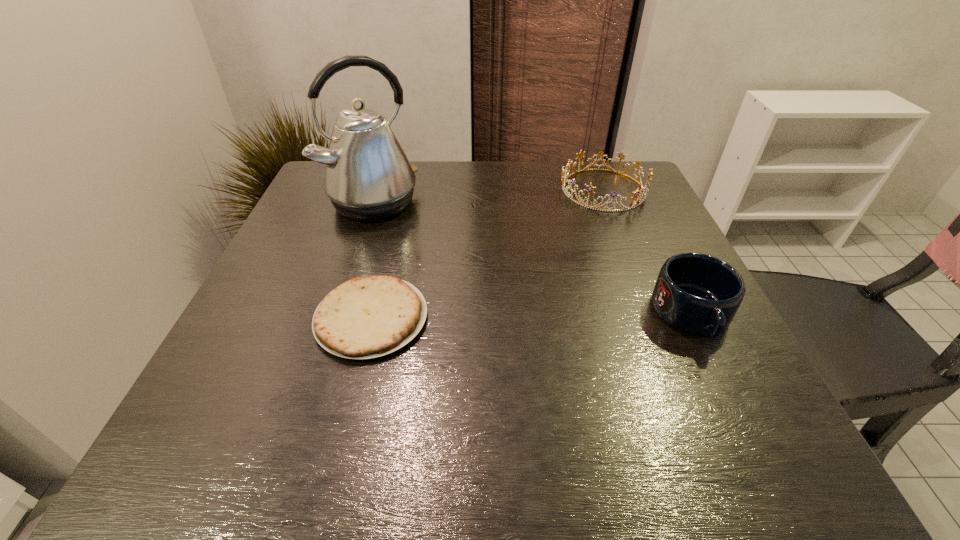
The height and width of the screenshot is (540, 960). I want to click on vacant space at the far edge of the desktop, so click(x=465, y=197).

Locate an element on the screen. Image resolution: width=960 pixels, height=540 pixels. vacant space at the near edge is located at coordinates (451, 377).

Find the location of a particular element. free space at the left edge is located at coordinates (293, 306).

In the image, there is a desktop. Identify the location of vacant space at the right edge. The height and width of the screenshot is (540, 960). (656, 234).

Locate an element on the screen. free spot at the far left corner of the desktop is located at coordinates (324, 192).

Locate an element on the screen. vacant space at the near left corner is located at coordinates (219, 408).

Find the location of a particular element. Image resolution: width=960 pixels, height=540 pixels. vacant region at the far right corner of the desktop is located at coordinates (607, 186).

The image size is (960, 540). Find the location of `free point at the near right corner`. free point at the near right corner is located at coordinates (691, 367).

Locate an element on the screen. The image size is (960, 540). free space between the tiara and the tallest object is located at coordinates (489, 196).

Locate an element on the screen. unoccupied position between the mug and the tortilla is located at coordinates (532, 316).